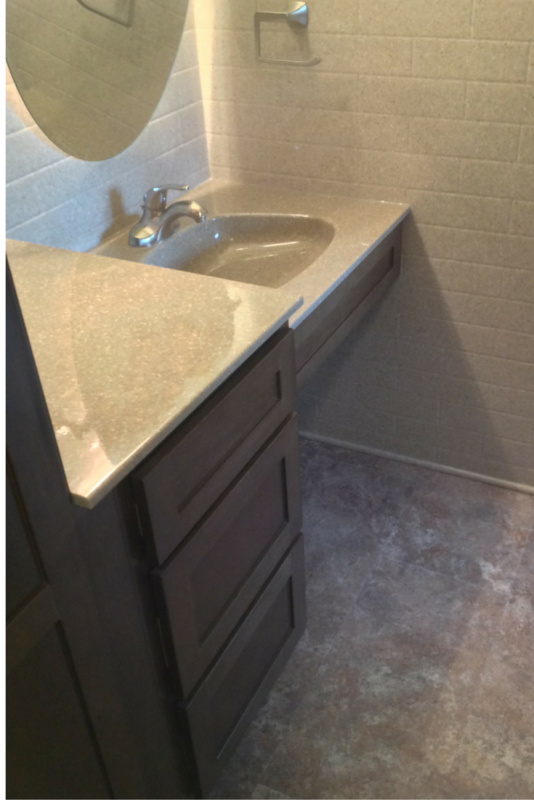
Find the location of a particular element. The width and height of the screenshot is (534, 800). mirror is located at coordinates (37, 86).